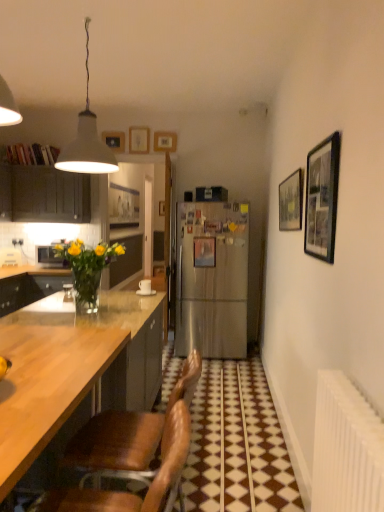
The image size is (384, 512). I want to click on black matte picture frame at upper right, marked as the 2th picture frame in a right-to-left arrangement, so click(x=322, y=198).

Measure the distance between point (x=331, y=214) and camera.

They are 1.85 meters apart.

Measure the distance between point (166,451) and camera.

They are 3.39 feet apart.

Locate an element on the screen. The image size is (384, 512). matte dark wood cabinet at left is located at coordinates (41, 187).

Describe the element at coordinates (114, 141) in the screenshot. I see `wooden picture frame at upper center, placed as the fifth picture frame when sorted from right to left` at that location.

What do you see at coordinates (139, 140) in the screenshot?
I see `wooden picture frame at upper center, which appears as the 3th picture frame when viewed from the back` at bounding box center [139, 140].

The height and width of the screenshot is (512, 384). What do you see at coordinates (291, 202) in the screenshot? I see `wooden picture frame at upper right, placed as the 6th picture frame when sorted from left to right` at bounding box center [291, 202].

Find the location of `black matte picture frame at upper right, placed as the 6th picture frame when sorted from back to front`. black matte picture frame at upper right, placed as the 6th picture frame when sorted from back to front is located at coordinates (322, 198).

Is matte wooden picture frame at upper center, acting as the sixth picture frame starting from the right, wider or thinner than wooden picture frame at upper center, which ranks as the fourth picture frame in left-to-right order?

Clearly, matte wooden picture frame at upper center, acting as the sixth picture frame starting from the right, has more width compared to wooden picture frame at upper center, which ranks as the fourth picture frame in left-to-right order.

From the image's perspective, is matte wooden picture frame at upper center, which is the 1th picture frame from back to front, above or below wooden picture frame at upper center, which ranks as the fourth picture frame in left-to-right order?

From the image's perspective, matte wooden picture frame at upper center, which is the 1th picture frame from back to front, appears below wooden picture frame at upper center, which ranks as the fourth picture frame in left-to-right order.

Can you tell me how much matte wooden picture frame at upper center, which is the 1th picture frame from back to front, and wooden picture frame at upper center, the third picture frame when ordered from front to back, differ in facing direction?

90.2 degrees.

From a real-world perspective, is matte wooden picture frame at upper center, the 6th picture frame positioned from the front, positioned above or below wooden picture frame at upper center, the third picture frame when ordered from front to back?

matte wooden picture frame at upper center, the 6th picture frame positioned from the front, is situated lower than wooden picture frame at upper center, the third picture frame when ordered from front to back, in the real world.

Is wooden picture frame at upper center, placed as the 4th picture frame when sorted from front to back, not near wooden picture frame at upper right, placed as the 6th picture frame when sorted from left to right?

Absolutely, wooden picture frame at upper center, placed as the 4th picture frame when sorted from front to back, is distant from wooden picture frame at upper right, placed as the 6th picture frame when sorted from left to right.

The image size is (384, 512). I want to click on the 4th picture frame above the wooden picture frame at upper right, which ranks as the 2th picture frame in front-to-back order (from a real-world perspective), so click(139, 140).

Is wooden picture frame at upper center, the third picture frame when ordered from left to right, facing away from wooden picture frame at upper right, the 1th picture frame positioned from the right?

That's not correct — wooden picture frame at upper center, the third picture frame when ordered from left to right, is not looking away from wooden picture frame at upper right, the 1th picture frame positioned from the right.

Is wooden picture frame at upper center, the third picture frame when ordered from left to right, in front of or behind wooden picture frame at upper right, acting as the 5th picture frame starting from the back, in the image?

wooden picture frame at upper center, the third picture frame when ordered from left to right, is behind wooden picture frame at upper right, acting as the 5th picture frame starting from the back.

What's the angular difference between wooden picture frame at upper center, the 3th picture frame from the right, and brown leather chair at lower left, the second chair viewed from the front,'s facing directions?

The angular difference between wooden picture frame at upper center, the 3th picture frame from the right, and brown leather chair at lower left, the second chair viewed from the front, is 91.5 degrees.

Based on the photo, is wooden picture frame at upper center, the 3th picture frame from the right, in contact with brown leather chair at lower left, the second chair viewed from the front?

No, wooden picture frame at upper center, the 3th picture frame from the right, is not in contact with brown leather chair at lower left, the second chair viewed from the front.

Between wooden picture frame at upper center, which is counted as the 4th picture frame, starting from the back, and brown leather chair at lower left, the second chair viewed from the front, which one appears on the right side from the viewer's perspective?

brown leather chair at lower left, the second chair viewed from the front.

From the picture: Is wooden picture frame at upper center, which is counted as the 4th picture frame, starting from the back, surrounding brown leather chair at lower left, the second chair viewed from the front?

No.

Considering the relative sizes of matte dark wood cabinet at left and brushed metal microwave at left in the image provided, is matte dark wood cabinet at left taller than brushed metal microwave at left?

Indeed, matte dark wood cabinet at left has a greater height compared to brushed metal microwave at left.

Considering the points (39, 178) and (45, 260), which point is behind, point (39, 178) or point (45, 260)?

Positioned behind is point (45, 260).

Could you tell me if matte dark wood cabinet at left is turned towards brushed metal microwave at left?

No, matte dark wood cabinet at left is not turned towards brushed metal microwave at left.

Which of these two, matte dark wood cabinet at left or brushed metal microwave at left, is bigger?

With larger size is matte dark wood cabinet at left.

Which is further, (x=173, y=143) or (x=143, y=140)?

Point (x=143, y=140)

In terms of height, does wooden picture frame at upper center, which is counted as the 4th picture frame, starting from the back, look taller or shorter compared to wooden picture frame at upper center, placed as the 4th picture frame when sorted from front to back?

Considering their sizes, wooden picture frame at upper center, which is counted as the 4th picture frame, starting from the back, has less height than wooden picture frame at upper center, placed as the 4th picture frame when sorted from front to back.

Is wooden picture frame at upper center, which ranks as the fourth picture frame in left-to-right order, behind wooden picture frame at upper center, which appears as the 3th picture frame when viewed from the back?

No, the depth of wooden picture frame at upper center, which ranks as the fourth picture frame in left-to-right order, is less than that of wooden picture frame at upper center, which appears as the 3th picture frame when viewed from the back.

Is wooden picture frame at upper center, which is counted as the 4th picture frame, starting from the back, far from wooden picture frame at upper center, the third picture frame when ordered from left to right?

No, wooden picture frame at upper center, which is counted as the 4th picture frame, starting from the back, is not far away from wooden picture frame at upper center, the third picture frame when ordered from left to right.

At what (x,y) coordinates should I click in order to perform the action: click on chair lying in front of the brown leather chair at lower left, the second chair viewed from the front. Please return your answer as a coordinate pair (x, y). Looking at the image, I should click on (131, 493).

Is brown leather chair at lower left, the second chair viewed from the front, taller or shorter than brown leather chair at lower center, which ranks as the 1th chair in front-to-back order?

brown leather chair at lower left, the second chair viewed from the front, is taller than brown leather chair at lower center, which ranks as the 1th chair in front-to-back order.

Consider the image. Are brown leather chair at lower left, marked as the first chair in a back-to-front arrangement, and brown leather chair at lower center, which ranks as the 1th chair in front-to-back order, located far from each other?

No, brown leather chair at lower left, marked as the first chair in a back-to-front arrangement, is not far away from brown leather chair at lower center, which ranks as the 1th chair in front-to-back order.

Which is in front, point (120, 443) or point (119, 495)?

The point (120, 443) is closer.

Is brown leather chair at lower center, which ranks as the 1th chair in front-to-back order, thinner than wooden picture frame at upper center, which is counted as the second picture frame, starting from the back?

Incorrect, the width of brown leather chair at lower center, which ranks as the 1th chair in front-to-back order, is not less than that of wooden picture frame at upper center, which is counted as the second picture frame, starting from the back.

Which picture frame is the 3rd one when counting from the left side of the brown leather chair at lower center, which ranks as the 1th chair in front-to-back order? Please provide its 2D coordinates.

[(114, 141)]

From a real-world perspective, does brown leather chair at lower center, which ranks as the 1th chair in front-to-back order, stand above wooden picture frame at upper center, which is the second picture frame in left-to-right order?

No, from a real-world perspective, brown leather chair at lower center, which ranks as the 1th chair in front-to-back order, is not above wooden picture frame at upper center, which is the second picture frame in left-to-right order.

From the image's perspective, count 1st picture frames upward from the matte wooden picture frame at upper center, which appears as the 1th picture frame when viewed from the left, and point to it. Please provide its 2D coordinates.

[(165, 142)]

Starting from the wooden picture frame at upper center, which appears as the 3th picture frame when viewed from the back, which picture frame is the 2nd one in front? Please provide its 2D coordinates.

[(291, 202)]

Looking at the image, which one is located further to brushed metal microwave at left, brown leather chair at lower center, which ranks as the 1th chair in front-to-back order, or white matte lampshade at upper center?

brown leather chair at lower center, which ranks as the 1th chair in front-to-back order, is positioned further to the anchor brushed metal microwave at left.

From the image, which object appears to be farther from brown leather chair at lower left, the second chair viewed from the front, wooden picture frame at upper center, which is counted as the 4th picture frame, starting from the back, or brushed metal microwave at left?

The object further to brown leather chair at lower left, the second chair viewed from the front, is wooden picture frame at upper center, which is counted as the 4th picture frame, starting from the back.

When comparing their distances from wooden picture frame at upper center, which appears as the 3th picture frame when viewed from the back, does wooden picture frame at upper center, which is the second picture frame in left-to-right order, or matte wooden picture frame at upper center, which is the 1th picture frame from back to front, seem further?

Among the two, matte wooden picture frame at upper center, which is the 1th picture frame from back to front, is located further to wooden picture frame at upper center, which appears as the 3th picture frame when viewed from the back.

Based on their spatial positions, is wooden picture frame at upper center, which ranks as the fourth picture frame in left-to-right order, or wooden picture frame at upper right, which ranks as the 2th picture frame in front-to-back order, further from wooden picture frame at upper center, placed as the fifth picture frame when sorted from right to left?

Based on the image, wooden picture frame at upper right, which ranks as the 2th picture frame in front-to-back order, appears to be further to wooden picture frame at upper center, placed as the fifth picture frame when sorted from right to left.

Estimate the real-world distances between objects in this image. Which object is further from black matte picture frame at upper right, placed as the 6th picture frame when sorted from back to front, brushed metal microwave at left or brown leather chair at lower left, marked as the first chair in a back-to-front arrangement?

brushed metal microwave at left lies further to black matte picture frame at upper right, placed as the 6th picture frame when sorted from back to front, than the other object.

Which object lies further to the anchor point brushed metal microwave at left, wooden picture frame at upper center, which is the fourth picture frame from right to left, or black matte picture frame at upper right, placed as the 6th picture frame when sorted from back to front?

black matte picture frame at upper right, placed as the 6th picture frame when sorted from back to front, is further to brushed metal microwave at left.

Which object lies further to the anchor point matte wooden picture frame at upper center, the 6th picture frame positioned from the front, black matte picture frame at upper right, the 1th picture frame viewed from the front, or wooden picture frame at upper right, the 1th picture frame positioned from the right?

Based on the image, black matte picture frame at upper right, the 1th picture frame viewed from the front, appears to be further to matte wooden picture frame at upper center, the 6th picture frame positioned from the front.

From the image, which object appears to be nearer to brown leather chair at lower left, marked as the first chair in a back-to-front arrangement, wooden picture frame at upper center, placed as the 4th picture frame when sorted from front to back, or wooden picture frame at upper center, the 5th picture frame positioned from the front?

wooden picture frame at upper center, placed as the 4th picture frame when sorted from front to back, is closer to brown leather chair at lower left, marked as the first chair in a back-to-front arrangement.

Find the location of a particular element. Image resolution: width=384 pixels, height=512 pixels. cabinetry between white matte lampshade at upper center and matte wooden picture frame at upper center, which is the 1th picture frame from back to front, from front to back is located at coordinates (41, 187).

Identify the location of appliance positioned between black matte picture frame at upper right, the 1th picture frame viewed from the front, and wooden picture frame at upper center, which is counted as the second picture frame, starting from the back, from near to far. tap(48, 257).

Find the location of a particular element. The height and width of the screenshot is (512, 384). appliance positioned between wooden picture frame at upper right, the 1th picture frame positioned from the right, and matte wooden picture frame at upper center, which is the 1th picture frame from back to front, from near to far is located at coordinates (48, 257).

Image resolution: width=384 pixels, height=512 pixels. Find the location of `appliance between brown leather chair at lower center, which ranks as the 1th chair in front-to-back order, and wooden picture frame at upper center, which is the second picture frame in left-to-right order, from front to back`. appliance between brown leather chair at lower center, which ranks as the 1th chair in front-to-back order, and wooden picture frame at upper center, which is the second picture frame in left-to-right order, from front to back is located at coordinates (48, 257).